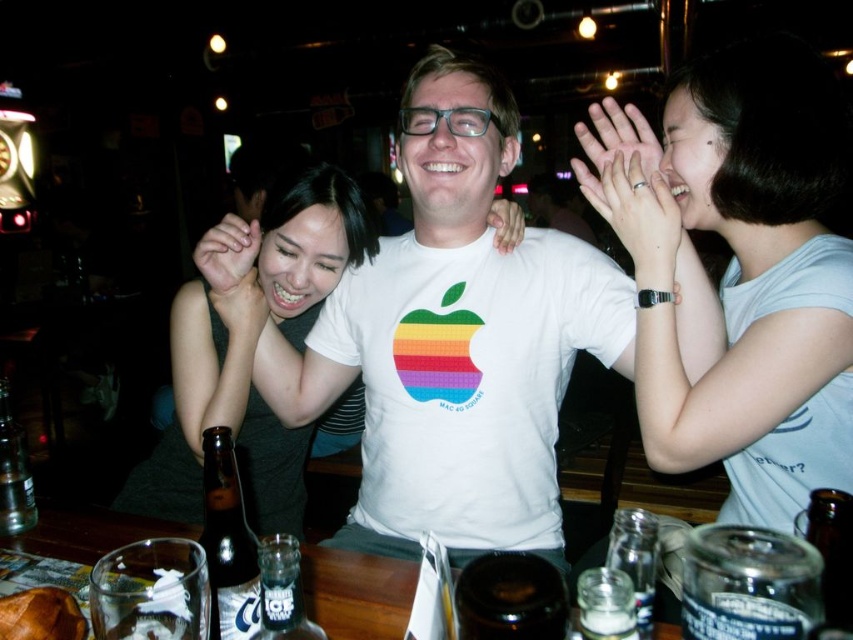
You are a photographer standing at the camera position. You want to take a closeup shot of the matte black hand at upper left. Is the hand within your camera lens range of 4 feet?

The matte black hand at upper left is 4.18 feet away from the camera, which is slightly beyond the 4 feet range, so the closeup shot may not be possible without moving closer.

Looking at this image, you are a bartender at the bar and need to locate the brown glass bottle at lower left. What are the coordinates where you can find it?

The brown glass bottle at lower left is located at coordinates point [227,541].

You are a bartender who needs to place a new drink order on the table. The table has limited space between the brown glass bottle at lower left and the matte silver ring at upper center. Can you fit the drink order between them?

The brown glass bottle at lower left is to the left of matte silver ring at upper center, so there is space between them to place the new drink order.